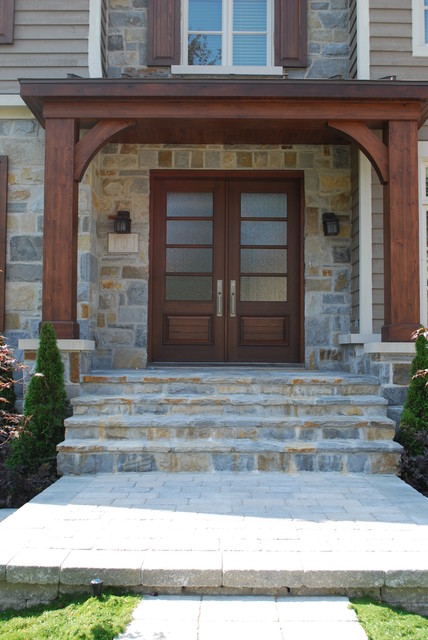
Where is `lower wooden door`? lower wooden door is located at coordinates (254, 328), (185, 333).